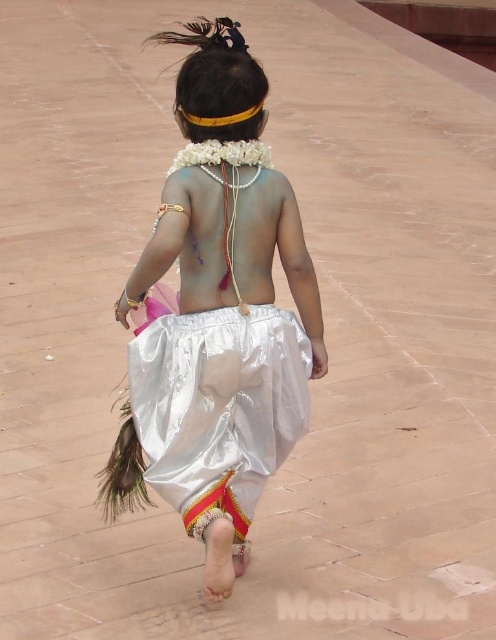
Can you confirm if shiny silver skirt at center is shorter than shiny white skirt at center?

Incorrect, shiny silver skirt at center's height does not fall short of shiny white skirt at center's.

Identify the location of shiny silver skirt at center. (218, 316).